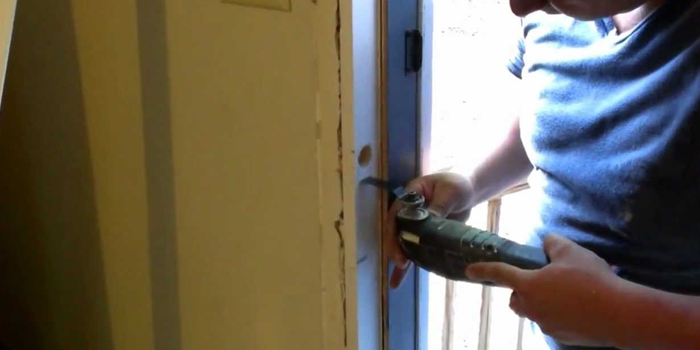
At what (x,y) coordinates should I click in order to perform the action: click on beige wall. Please return your answer as a coordinate pair (x, y). The image size is (700, 350). Looking at the image, I should click on (242, 175).